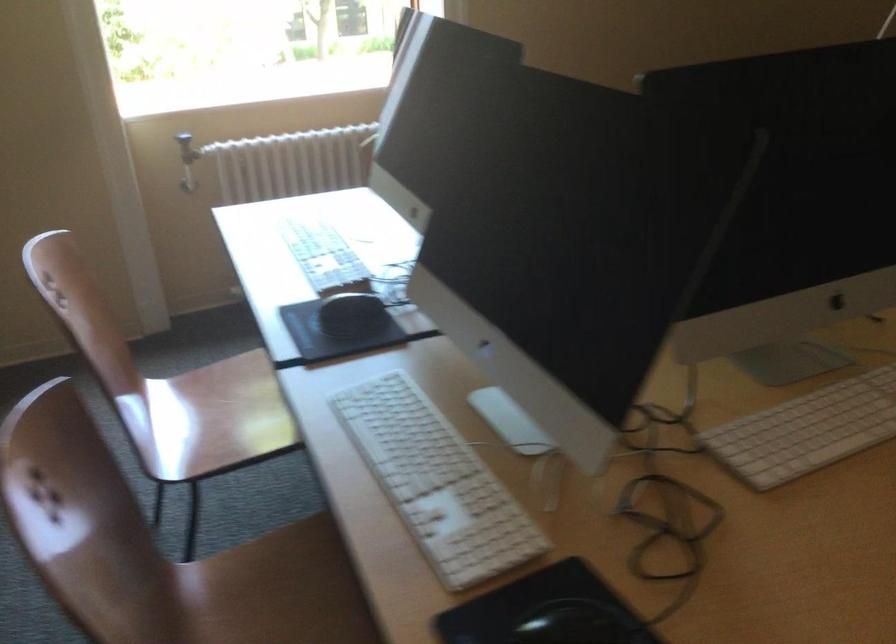
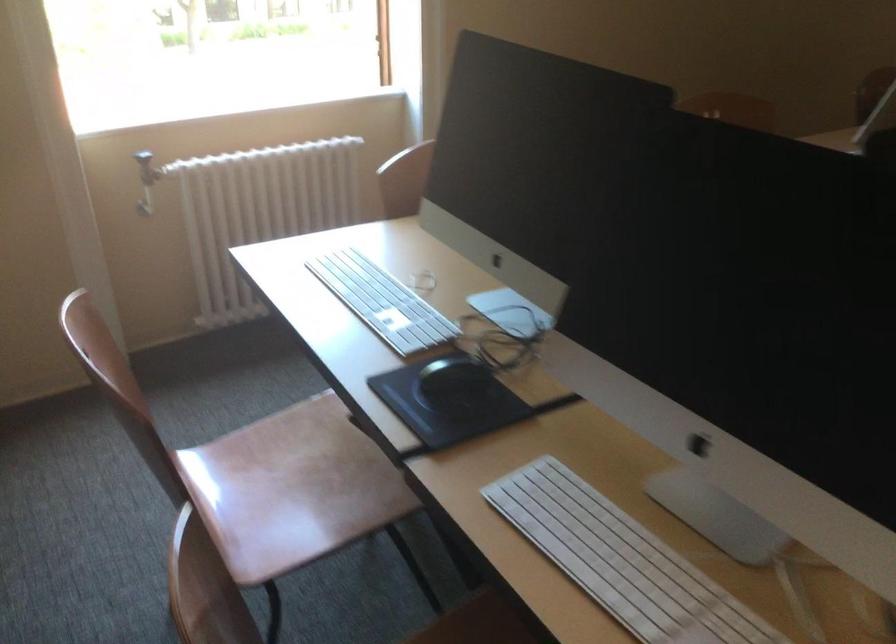
Question: The images are taken continuously from a first-person perspective. In which direction is your viewpoint rotating?

Choices:
 (A) Left
 (B) Right
 (C) Up
 (D) Down

Answer: (B)